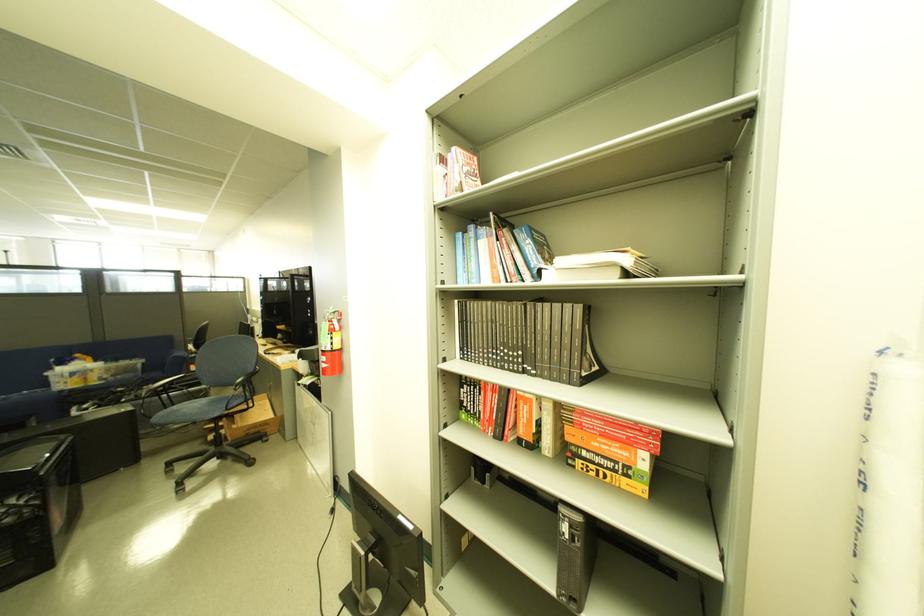
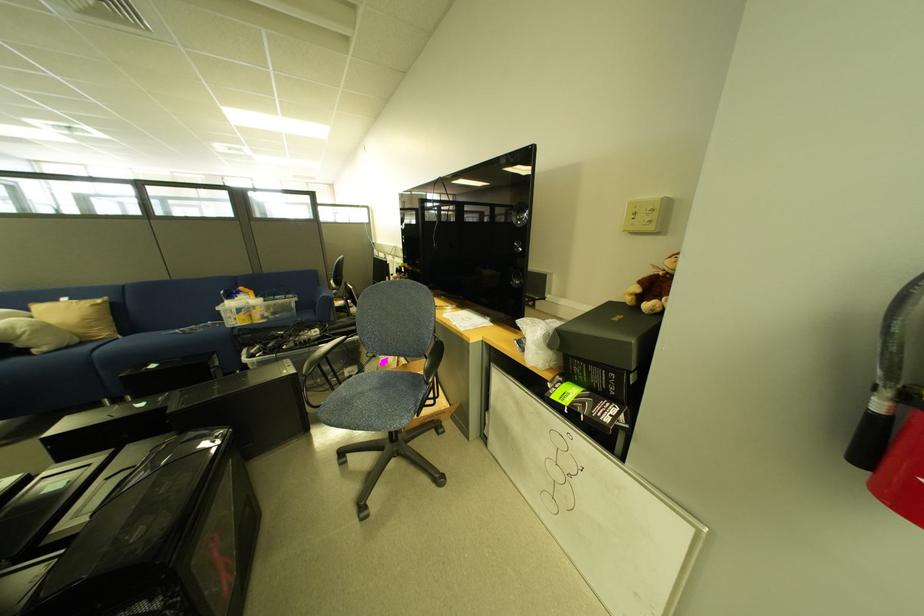
The images are taken continuously from a first-person perspective. In which direction are you moving?

The cameraman moved toward left, forward.